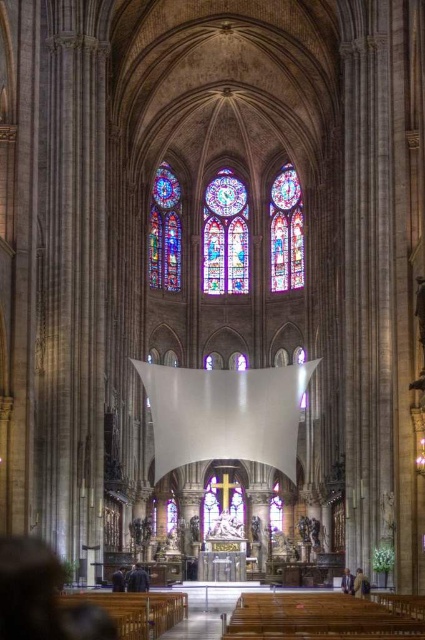
Can you confirm if stained glass window at center is positioned to the right of stained glass window at upper center?

No, stained glass window at center is not to the right of stained glass window at upper center.

Does stained glass window at center have a smaller size compared to stained glass window at upper center?

Incorrect, stained glass window at center is not smaller in size than stained glass window at upper center.

Between point (206, 208) and point (303, 275), which one is positioned in front?

Point (303, 275) is in front.

The height and width of the screenshot is (640, 425). I want to click on stained glass window at center, so click(224, 236).

What do you see at coordinates (286, 230) in the screenshot? The height and width of the screenshot is (640, 425). I see `stained glass window at upper center` at bounding box center [286, 230].

What do you see at coordinates (286, 230) in the screenshot? I see `stained glass window at upper center` at bounding box center [286, 230].

At what (x,y) coordinates should I click in order to perform the action: click on stained glass window at upper center. Please return your answer as a coordinate pair (x, y). The height and width of the screenshot is (640, 425). Looking at the image, I should click on (286, 230).

Does stained glass window at center have a smaller size compared to multicolored stained glass at center?

No.

Which of these two, stained glass window at center or multicolored stained glass at center, stands taller?

stained glass window at center is taller.

Who is more forward, (x=248, y=232) or (x=156, y=276)?

Positioned in front is point (x=156, y=276).

Locate an element on the screen. The image size is (425, 640). stained glass window at center is located at coordinates (224, 236).